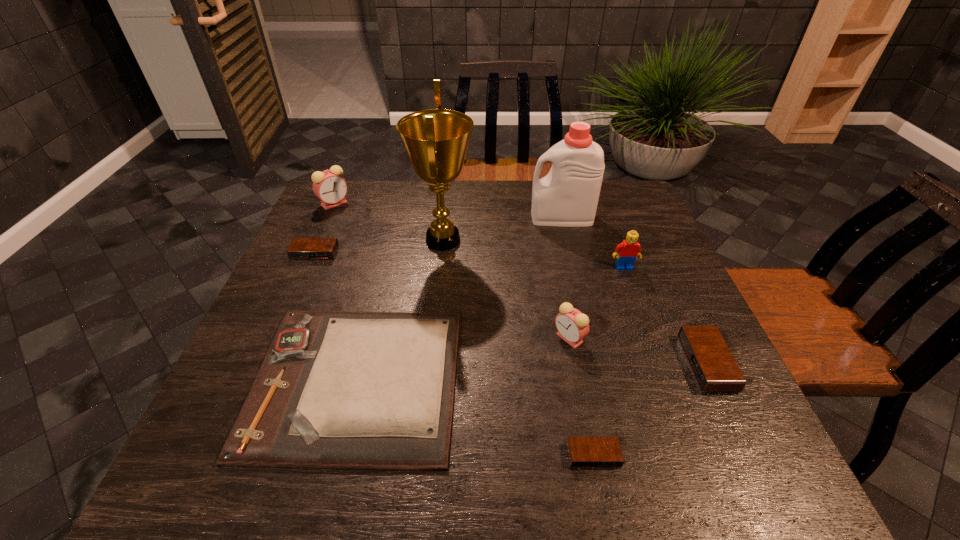
You are a GUI agent. You are given a task and a screenshot of the screen. Output one action in this format:
    pyautogui.click(x=<x>, y=<y>)
    Task: Click on the rightmost object
    
    Given the screenshot: What is the action you would take?
    pyautogui.click(x=714, y=367)

Identify the location of the second biggest black alarm clock. (301, 248).

The width and height of the screenshot is (960, 540). I want to click on the fourth tallest alarm clock, so click(301, 248).

I want to click on clipboard, so click(x=366, y=390).

Identify the location of the smallest black alarm clock. This screenshot has width=960, height=540. point(584,452).

Where is `the nearest black alarm clock`? the nearest black alarm clock is located at coordinates (584, 452).

Identify the location of free space located on the front view with handles of the tallest object. Image resolution: width=960 pixels, height=540 pixels. (524, 240).

Locate an element on the screen. The image size is (960, 540). blank area located on the handle side of the detergent is located at coordinates (470, 218).

This screenshot has width=960, height=540. I want to click on vacant space situated on the handle side of the detergent, so click(500, 218).

Locate an element on the screen. The height and width of the screenshot is (540, 960). vacant region located 0.070m on the handle side of the detergent is located at coordinates (507, 218).